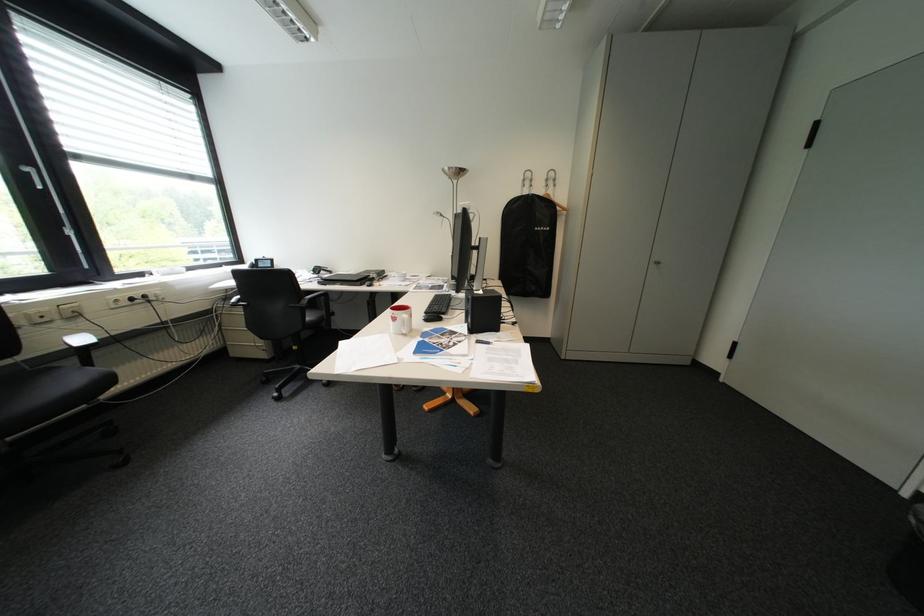
This screenshot has width=924, height=616. What do you see at coordinates (399, 318) in the screenshot? I see `the white and red mug` at bounding box center [399, 318].